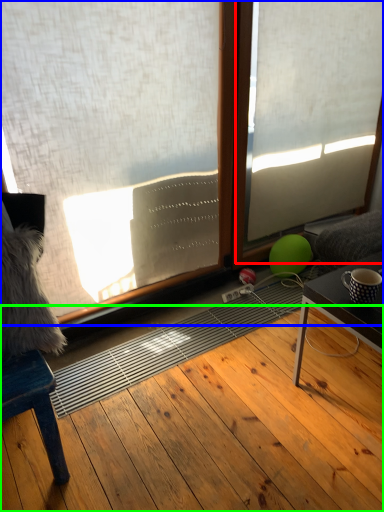
Question: Based on their relative distances, which object is farther from window frame (highlighted by a red box)? Choose from window (highlighted by a blue box) and hardwood (highlighted by a green box).

Choices:
 (A) window
 (B) hardwood

Answer: (B)